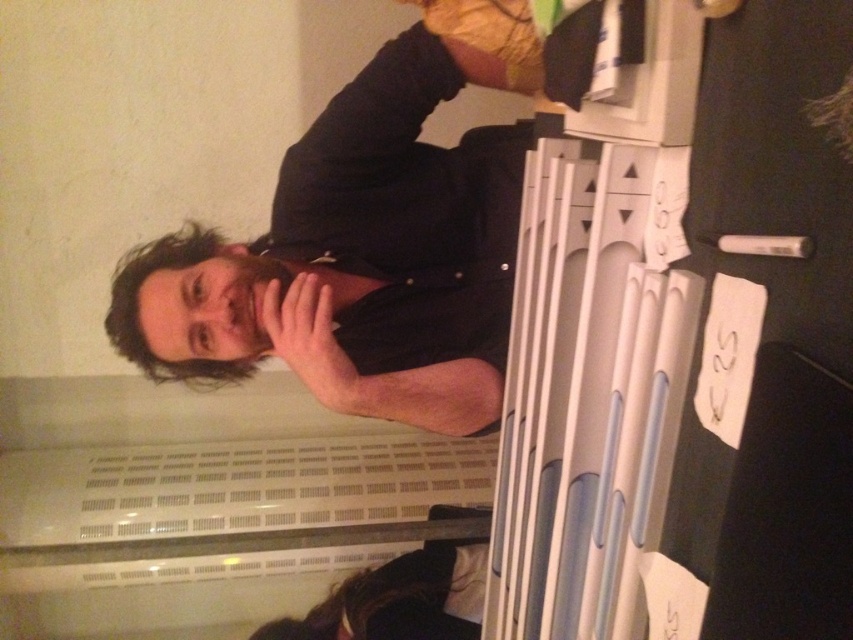
Where is the black matte shirt at center located in the image?

The black matte shirt at center is located at point coordinates of approximately 0.402 in the x axis and 0.419 in the y axis.

You are a photographer trying to capture a portrait of the person in the image. You notice the black matte shirt at center and the dark brown hair at upper left. Which of these two elements should you adjust your focus on if you want to ensure the wider subject is in sharp focus?

The black matte shirt at center should be the focus since its width is larger than the dark brown hair at upper left.

Looking at the image, where is the black matte shirt at center in relation to the dark brown hair at upper left?

The black matte shirt at center is to the right of the dark brown hair at upper left.